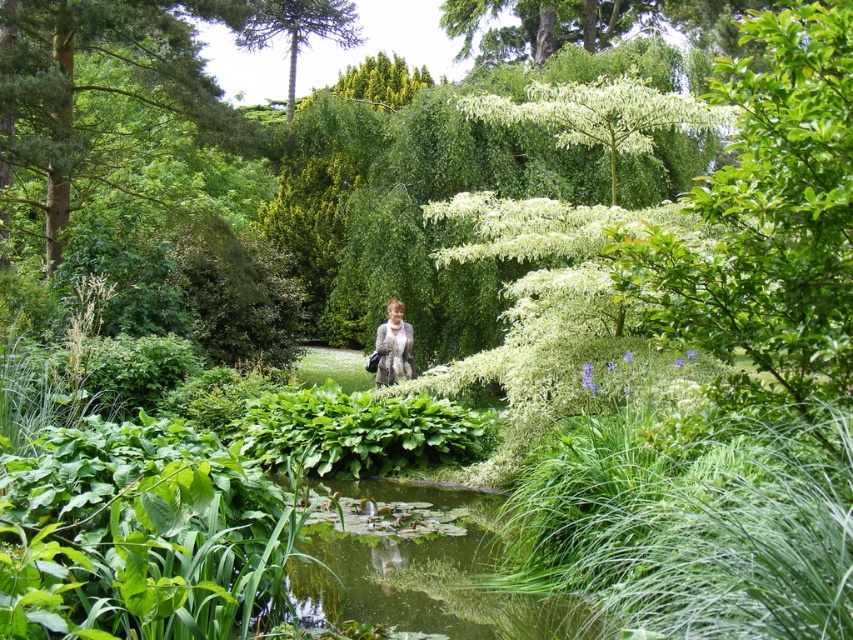
Can you confirm if green mossy pond at center is shorter than light gray fur coat at center?

Yes, green mossy pond at center is shorter than light gray fur coat at center.

Does green mossy pond at center have a smaller size compared to light gray fur coat at center?

No, green mossy pond at center is not smaller than light gray fur coat at center.

Identify the location of green mossy pond at center. Image resolution: width=853 pixels, height=640 pixels. (421, 566).

Locate an element on the screen. The width and height of the screenshot is (853, 640). green mossy pond at center is located at coordinates (421, 566).